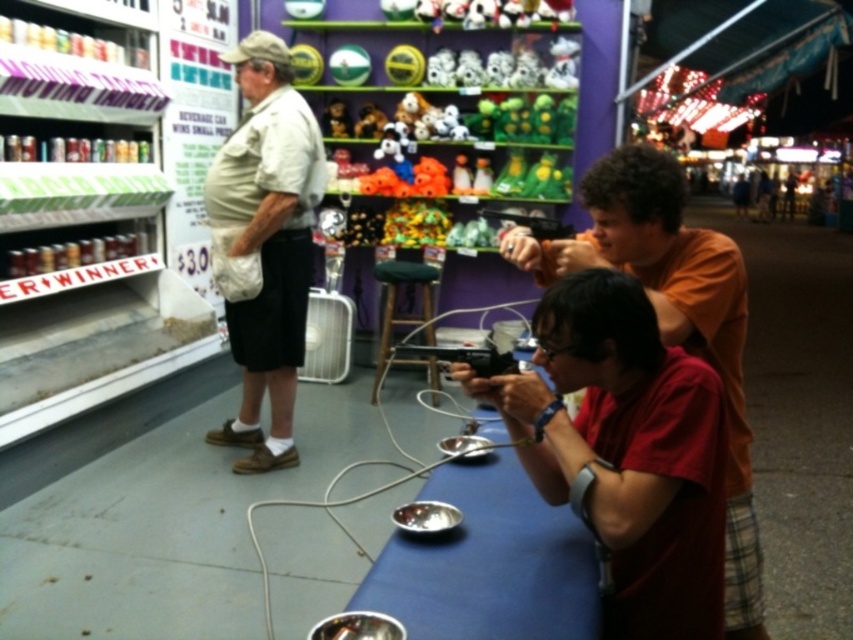
Question: Can you confirm if khaki cotton shirt at left is thinner than matte black gun at center?

Choices:
 (A) yes
 (B) no

Answer: (B)

Question: Does khaki cotton shirt at left have a larger size compared to orange cotton shirt at center?

Choices:
 (A) no
 (B) yes

Answer: (B)

Question: Which point appears farthest from the camera in this image?

Choices:
 (A) (410, 353)
 (B) (573, 232)
 (C) (547, 266)

Answer: (B)

Question: Can you confirm if khaki cotton shirt at left is positioned to the right of orange cotton shirt at center?

Choices:
 (A) yes
 (B) no

Answer: (B)

Question: Which point is closer to the camera taking this photo?

Choices:
 (A) (212, 436)
 (B) (515, 252)
 (C) (425, 355)

Answer: (C)

Question: Which point appears closest to the camera in this image?

Choices:
 (A) (480, 362)
 (B) (723, 241)
 (C) (276, 88)
 (D) (512, 220)

Answer: (A)